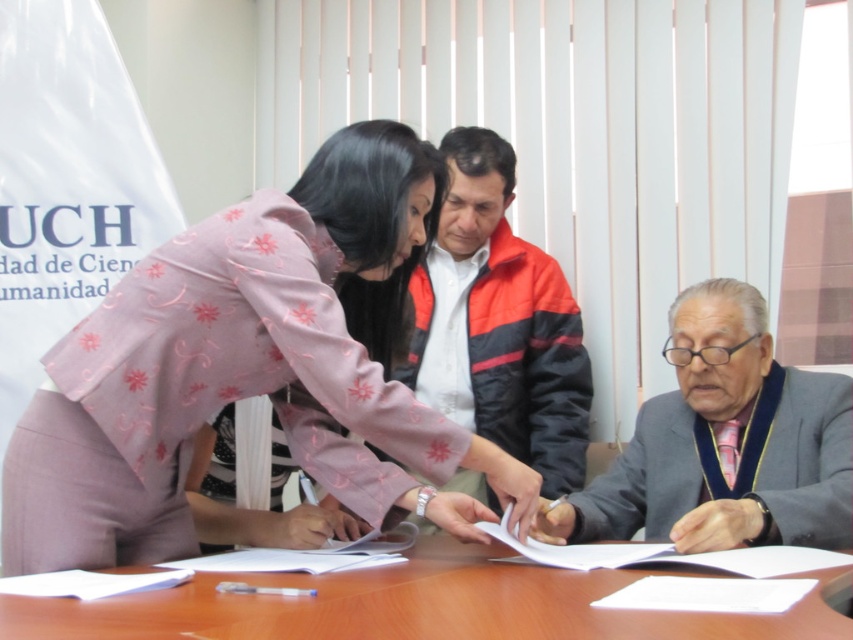
Question: Does pink floral fabric at center have a smaller size compared to wooden table at center?

Choices:
 (A) no
 (B) yes

Answer: (A)

Question: Which object is the farthest from the pink floral fabric at center?

Choices:
 (A) gray wool suit at lower right
 (B) wooden table at center

Answer: (A)

Question: Is pink floral fabric at center to the right of wooden table at center from the viewer's perspective?

Choices:
 (A) no
 (B) yes

Answer: (A)

Question: Which point is closer to the camera?

Choices:
 (A) pink floral fabric at center
 (B) gray wool suit at lower right
 (C) wooden table at center

Answer: (C)

Question: Can you confirm if gray wool suit at lower right is thinner than wooden table at center?

Choices:
 (A) yes
 (B) no

Answer: (A)

Question: Which point appears closest to the camera in this image?

Choices:
 (A) (300, 628)
 (B) (271, 371)
 (C) (697, 353)

Answer: (A)